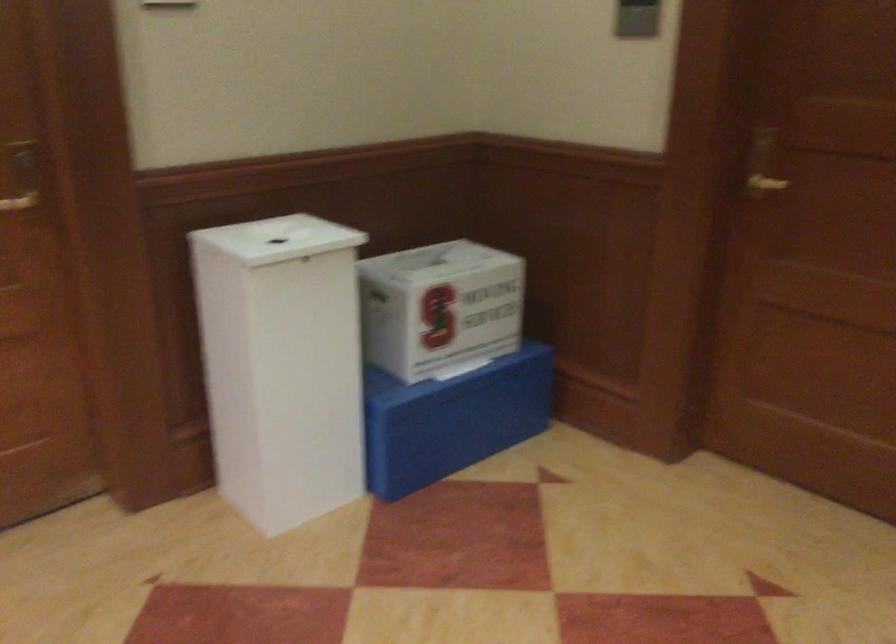
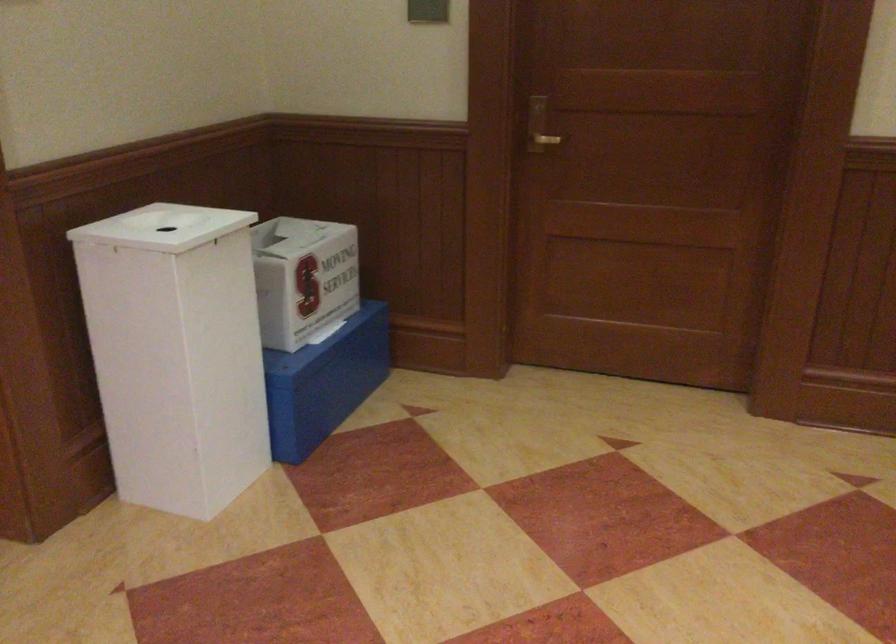
Question: The images are taken continuously from a first-person perspective. In which direction are you moving?

Choices:
 (A) Left
 (B) Right
 (C) Forward
 (D) Backward

Answer: (A)